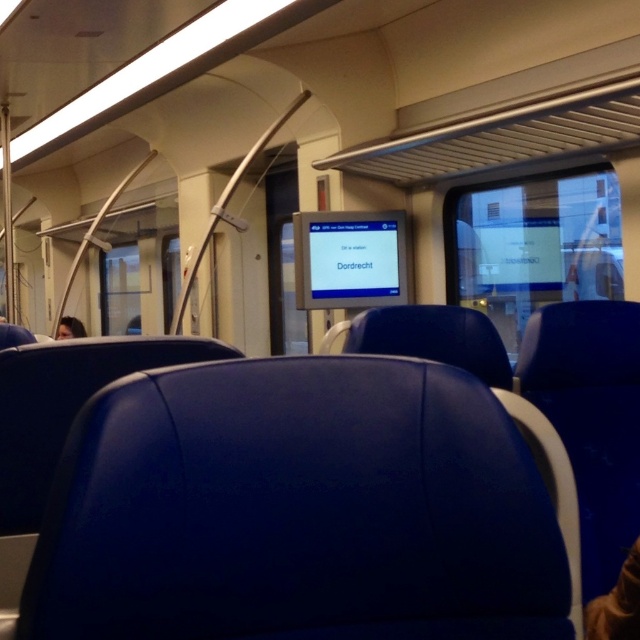
Question: Does matte blue seat at center come in front of smooth skin face at left?

Choices:
 (A) yes
 (B) no

Answer: (A)

Question: Does matte blue seat at center have a smaller size compared to smooth skin face at left?

Choices:
 (A) yes
 (B) no

Answer: (B)

Question: Which point is closer to the camera?

Choices:
 (A) click(x=76, y=564)
 (B) click(x=60, y=323)

Answer: (A)

Question: Can you confirm if matte blue seat at center is thinner than smooth skin face at left?

Choices:
 (A) yes
 (B) no

Answer: (B)